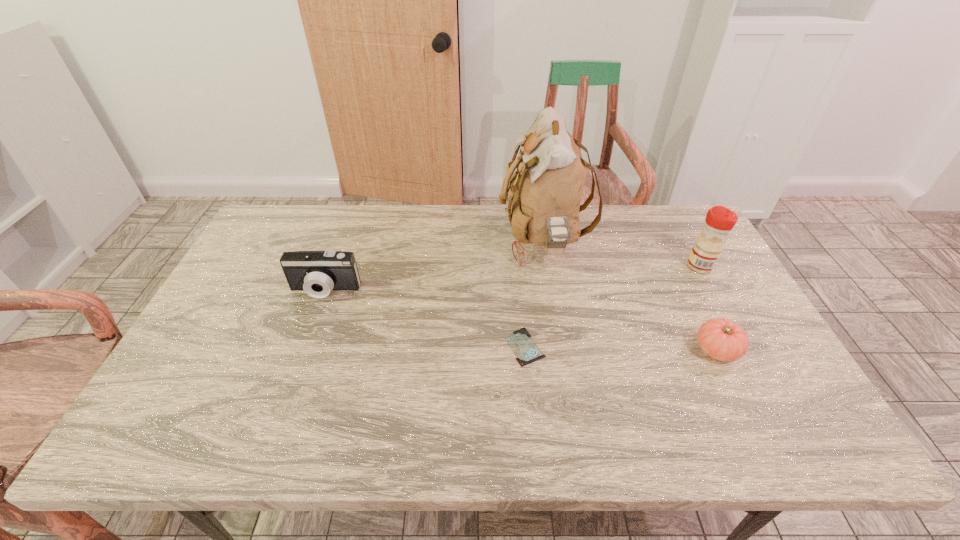
Where is `vacant area situated 0.320m on the lens of the third tallest object`? The width and height of the screenshot is (960, 540). vacant area situated 0.320m on the lens of the third tallest object is located at coordinates (285, 400).

What are the coordinates of `vacant region located on the left of the fourth tallest object` in the screenshot? It's located at (578, 350).

The height and width of the screenshot is (540, 960). Identify the location of free space located on the left of the shortest object. (401, 347).

At what (x,y) coordinates should I click in order to perform the action: click on object situated at the far edge. Please return your answer as a coordinate pair (x, y). Looking at the image, I should click on pos(545,192).

In order to click on condiment at the right edge in this screenshot , I will do `click(719, 221)`.

This screenshot has height=540, width=960. Find the location of `tomato that is at the right edge`. tomato that is at the right edge is located at coordinates (721, 339).

Identify the location of vacant position at the far edge of the desktop. tap(592, 233).

I want to click on vacant space at the near edge, so click(x=644, y=446).

Image resolution: width=960 pixels, height=540 pixels. I want to click on vacant space at the left edge of the desktop, so click(243, 367).

Where is `vacant space at the right edge of the desktop`? The image size is (960, 540). vacant space at the right edge of the desktop is located at coordinates (682, 281).